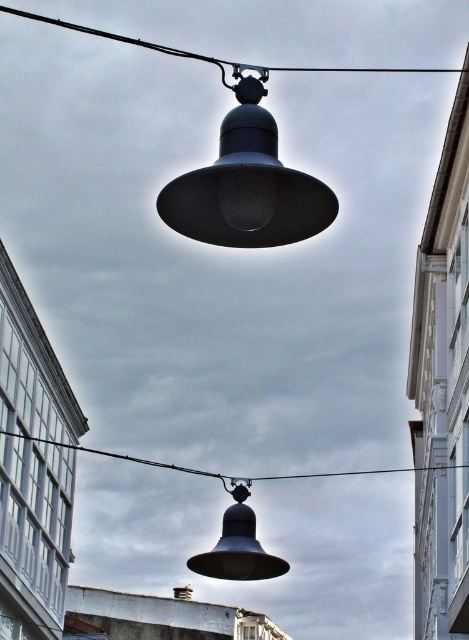
Question: Among these objects, which one is nearest to the camera?

Choices:
 (A) black wire at upper center
 (B) black wire at center
 (C) matte black lamp at upper center
 (D) matte black bell at lower center

Answer: (C)

Question: Is matte black lamp at upper center positioned before matte black bell at lower center?

Choices:
 (A) yes
 (B) no

Answer: (A)

Question: Which object appears farthest from the camera in this image?

Choices:
 (A) matte black lamp at upper center
 (B) matte black bell at lower center
 (C) black wire at upper center

Answer: (B)

Question: Which of the following is the farthest from the observer?

Choices:
 (A) black wire at center
 (B) matte black lamp at upper center

Answer: (A)

Question: Does matte black lamp at upper center appear on the right side of black wire at center?

Choices:
 (A) no
 (B) yes

Answer: (A)

Question: Is matte black lamp at upper center closer to the viewer compared to matte black bell at lower center?

Choices:
 (A) yes
 (B) no

Answer: (A)